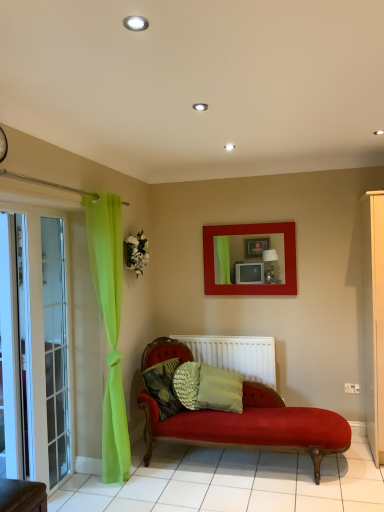
Question: Is white glass screen door at left, arranged as the 2th screen door when viewed from the back, taller or shorter than white matte radiator at center?

Choices:
 (A) tall
 (B) short

Answer: (A)

Question: From the image's perspective, relative to white matte radiator at center, is white glass screen door at left, which is counted as the 1th screen door, starting from the front, above or below?

Choices:
 (A) below
 (B) above

Answer: (B)

Question: Estimate the real-world distances between objects in this image. Which object is farther from the white glass screen door at left, which is counted as the 1th screen door, starting from the front?

Choices:
 (A) textured green pillow at center
 (B) transparent glass screen door at left, marked as the second screen door in a front-to-back arrangement
 (C) white matte radiator at center
 (D) clear glass door at left
 (E) matte red picture frame at center

Answer: (E)

Question: Estimate the real-world distances between objects in this image. Which object is closer to the textured green pillow at center?

Choices:
 (A) white glass screen door at left, arranged as the 2th screen door when viewed from the back
 (B) matte red picture frame at center
 (C) white matte radiator at center
 (D) clear glass door at left
 (E) transparent glass screen door at left, marked as the second screen door in a front-to-back arrangement

Answer: (C)